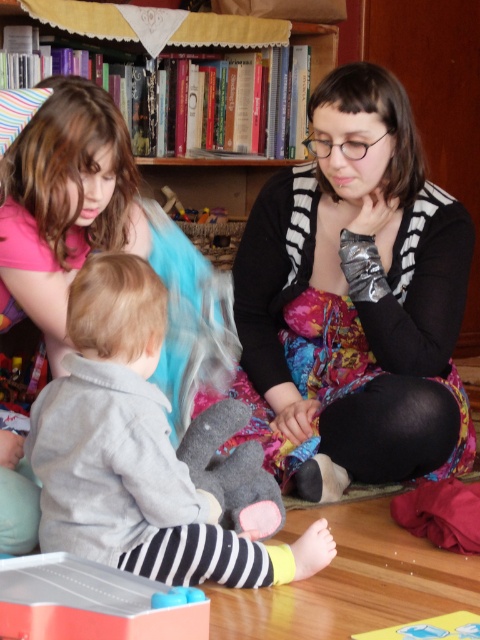
Between point (162, 173) and point (182, 595), which one is positioned behind?

The point (162, 173) is behind.

Can you confirm if wooden bookshelf at upper center is positioned below smooth plastic toy at lower center?

No.

Is point (119, 44) less distant than point (155, 596)?

No, it is not.

You are a GUI agent. You are given a task and a screenshot of the screen. Output one action in this format:
    pyautogui.click(x=<x>, y=<y>)
    Task: Click on the wooden bookshelf at upper center
    
    Given the screenshot: What is the action you would take?
    pyautogui.click(x=214, y=182)

From the picture: Which of these two, gray soft sweater at center or translucent plastic toy at lower left, stands shorter?

Standing shorter between the two is translucent plastic toy at lower left.

Can you confirm if gray soft sweater at center is thinner than translucent plastic toy at lower left?

Incorrect, gray soft sweater at center's width is not less than translucent plastic toy at lower left's.

Is point (103, 408) behind point (147, 605)?

Yes, it is behind point (147, 605).

Locate an element on the screen. This screenshot has width=480, height=640. gray soft sweater at center is located at coordinates (143, 451).

The height and width of the screenshot is (640, 480). I want to click on black and white striped sweater at center, so click(x=356, y=300).

How far apart are black and white striped sweater at center and smooth plastic toy at lower center?

black and white striped sweater at center and smooth plastic toy at lower center are 1.23 meters apart.

Which is behind, point (394, 422) or point (192, 596)?

The point (394, 422) is behind.

Where is `black and white striped sweater at center`? This screenshot has height=640, width=480. black and white striped sweater at center is located at coordinates (356, 300).